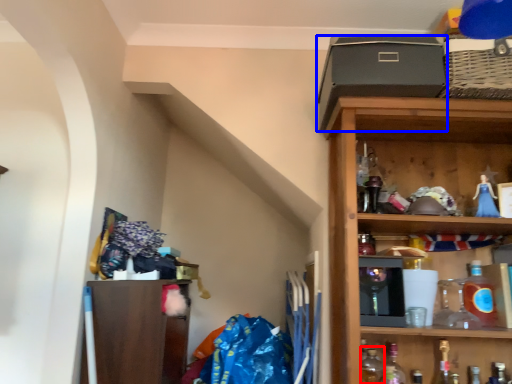
Question: Which object appears farthest to the camera in this image, bottle (highlighted by a red box) or box (highlighted by a blue box)?

Choices:
 (A) bottle
 (B) box

Answer: (A)